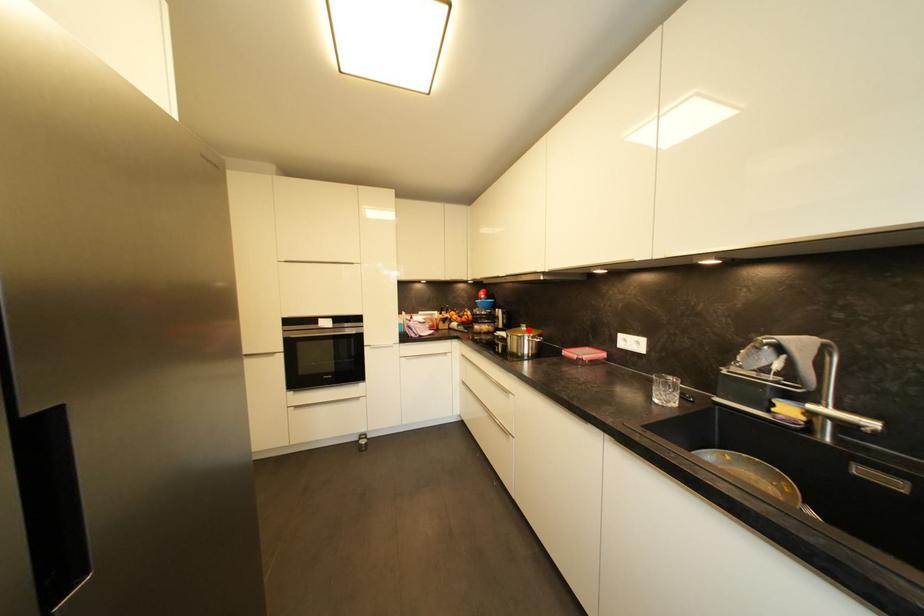
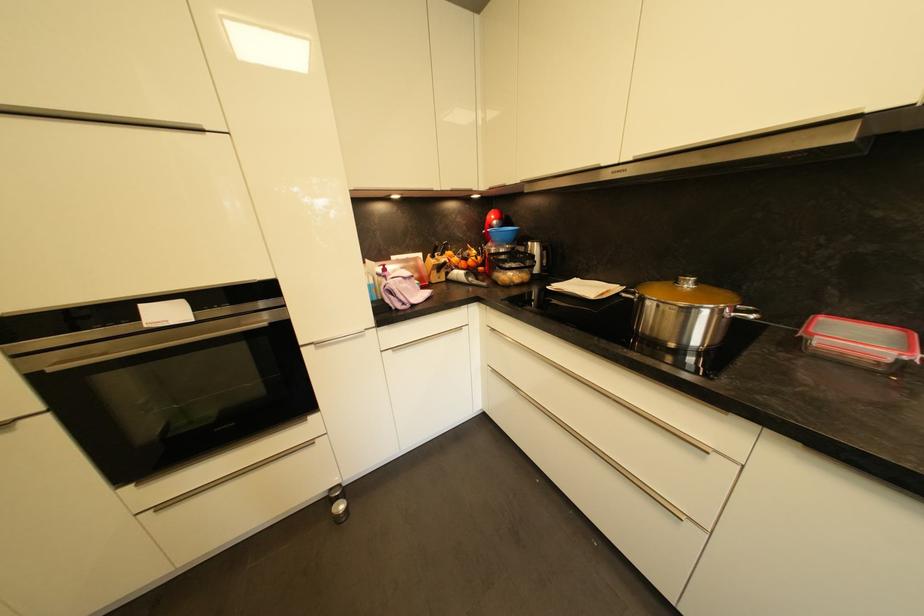
Where in the second image is the point corresponding to the highlighted location from the first image?

(694, 286)